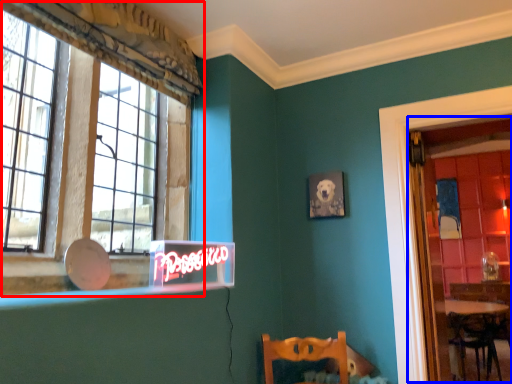
Question: Which point is closer to the camera, window (highlighted by a red box) or glass door (highlighted by a blue box)?

Choices:
 (A) window
 (B) glass door

Answer: (A)